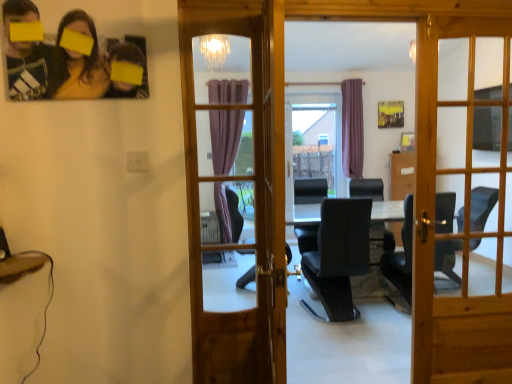
Question: Should I look upward or downward to see wooden door at center, the 1th door from the left?

Choices:
 (A) down
 (B) up

Answer: (A)

Question: From a real-world perspective, is black leather chair at center beneath wooden door at center, which ranks as the 2th door in left-to-right order?

Choices:
 (A) yes
 (B) no

Answer: (A)

Question: From the image's perspective, is black leather chair at center located beneath wooden door at center, which ranks as the 2th door in left-to-right order?

Choices:
 (A) yes
 (B) no

Answer: (A)

Question: Is black leather chair at center bigger than wooden door at center, which ranks as the 2th door in left-to-right order?

Choices:
 (A) yes
 (B) no

Answer: (A)

Question: Does black leather chair at center come behind wooden door at center, which ranks as the 2th door in left-to-right order?

Choices:
 (A) yes
 (B) no

Answer: (A)

Question: Would you consider black leather chair at center to be distant from wooden door at center, which ranks as the 2th door in left-to-right order?

Choices:
 (A) no
 (B) yes

Answer: (B)

Question: Is black leather chair at center located outside wooden door at center, which ranks as the 2th door in left-to-right order?

Choices:
 (A) yes
 (B) no

Answer: (A)

Question: Is wooden door at center, marked as the 1th door in a right-to-left arrangement, oriented towards matte black photo frame at upper left?

Choices:
 (A) yes
 (B) no

Answer: (B)

Question: Is wooden door at center, which ranks as the 2th door in left-to-right order, oriented away from matte black photo frame at upper left?

Choices:
 (A) yes
 (B) no

Answer: (B)

Question: From a real-world perspective, does wooden door at center, which ranks as the 2th door in left-to-right order, stand above matte black photo frame at upper left?

Choices:
 (A) yes
 (B) no

Answer: (B)

Question: Considering the relative positions of wooden door at center, which ranks as the 2th door in left-to-right order, and matte black photo frame at upper left in the image provided, is wooden door at center, which ranks as the 2th door in left-to-right order, to the left of matte black photo frame at upper left from the viewer's perspective?

Choices:
 (A) no
 (B) yes

Answer: (A)

Question: Does wooden door at center, marked as the 1th door in a right-to-left arrangement, have a greater height compared to matte black photo frame at upper left?

Choices:
 (A) no
 (B) yes

Answer: (B)

Question: Is matte black photo frame at upper left surrounded by wooden door at center, marked as the 1th door in a right-to-left arrangement?

Choices:
 (A) yes
 (B) no

Answer: (B)

Question: Can you confirm if wooden door at center, which ranks as the 2th door in right-to-left order, is smaller than matte black photo frame at upper left?

Choices:
 (A) yes
 (B) no

Answer: (B)